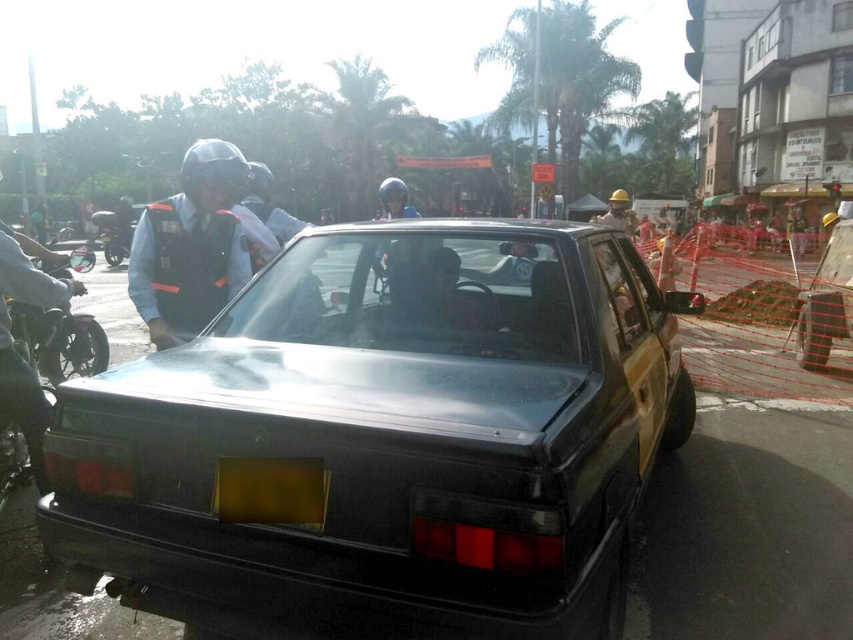
You are a delivery person who needs to park your 12 feet long truck between the metallic silver car at center and the hard hat at center. Can you fit your truck in that space?

The metallic silver car at center is 13.04 feet from the hard hat at center. Since your truck is 12 feet long, it can fit in the space between them as the distance is sufficient.

You are a delivery person who needs to load a metallic silver car at center with a hard hat at center. Based on their sizes, which item can fit into the other?

The metallic silver car at center has a smaller size compared to the hard hat at center, so the metallic silver car at center cannot fit into the hard hat at center. However, the hard hat at center can fit into the metallic silver car at center since it is smaller.

You are a delivery person who needs to park your 1.8 meters tall delivery cart between the black matte car at center and the hard hat at center. Can you fit your cart there without overlapping either object?

The black matte car at center is shorter than the hard hat at center. Since your delivery cart is 1.8 meters tall, you need to ensure there is enough vertical space between them. However, the description only provides information about their heights relative to each other, not the actual vertical clearance. Without knowing the exact height difference or the available space, it is uncertain if the cart will fit. Please check the actual space before parking.